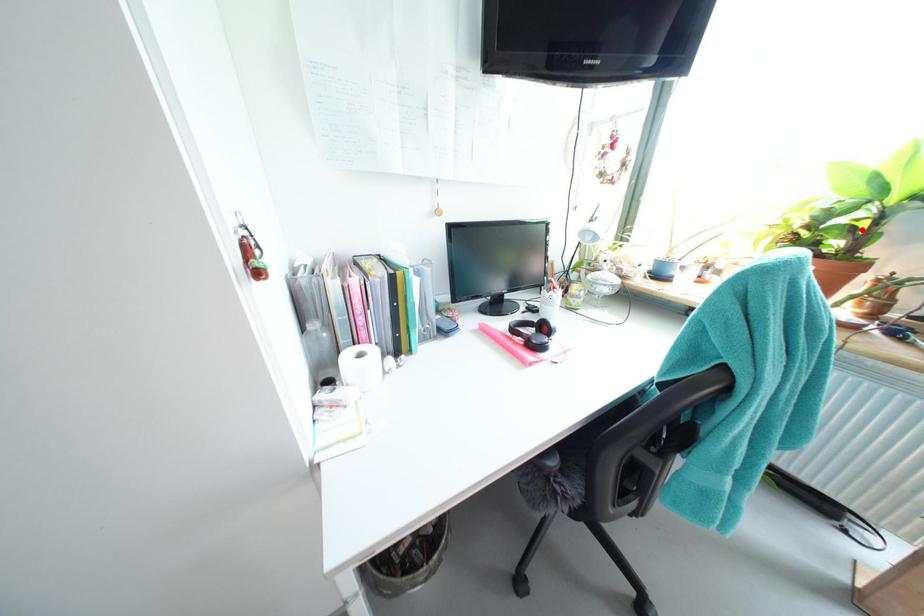
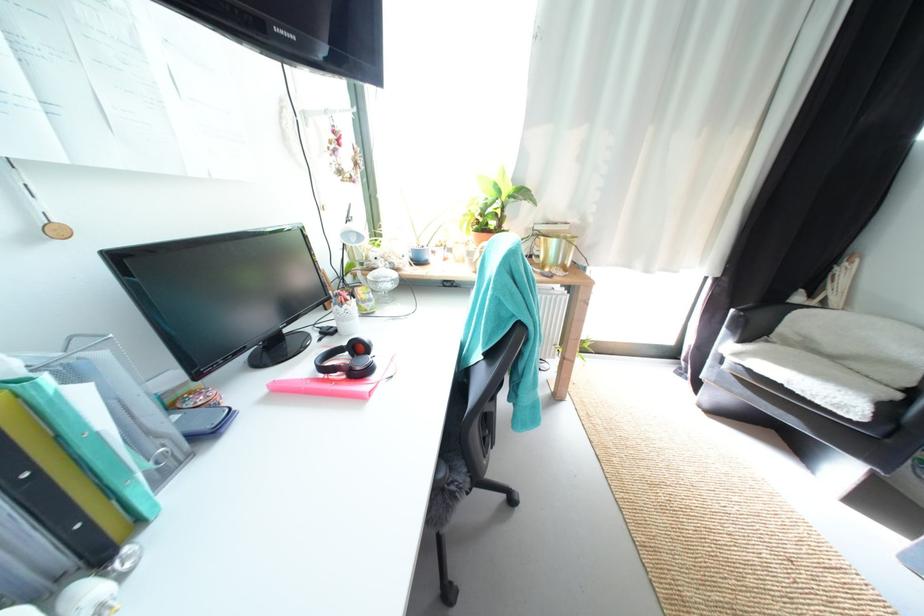
Find the pixel in the second image that matches the highlighted location in the first image.

(505, 216)